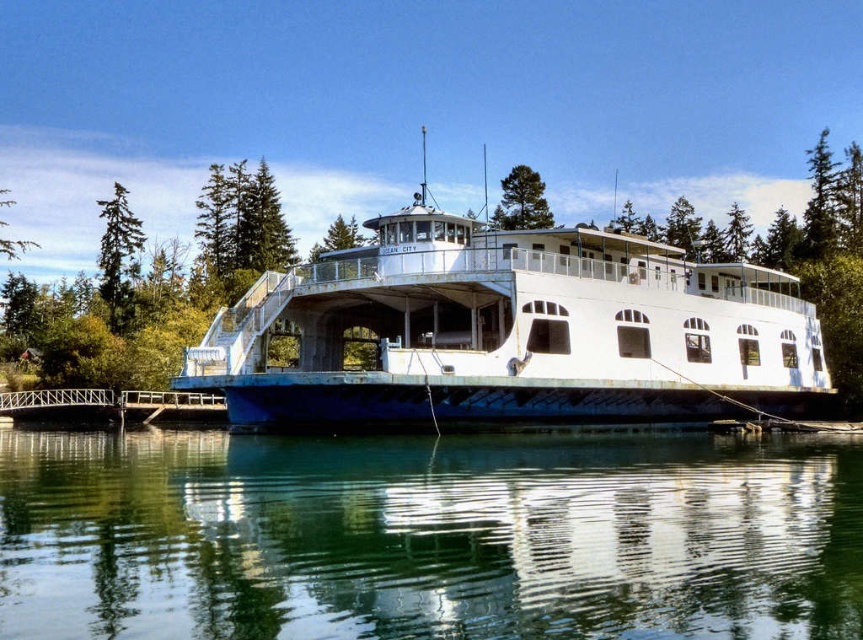
You are standing on the pier and want to board the ferry. The ferry is connected via a metal walkway. Where is the clear glass water at center in relation to your position?

The clear glass water at center is located at point coordinates (427, 536), which is near the center of the image, so it is positioned between the pier and the ferry where the metal walkway leads towards the ferry.

You are standing on the ferry and looking towards the pier. You notice two green trees in the distance. Which tree, the green textured tree at upper center or the green leafy tree at upper left, appears closer to you based on their sizes?

The green textured tree at upper center appears closer because it is shorter than the green leafy tree at upper left, which means the taller tree is farther away.

You are standing on the metallic gray dock at lower left and want to reach the green textured tree at upper center. The path between them is a straight walkway. If your walking speed is 3 feet per second, how many seconds will it take you to reach the tree?

The distance between the metallic gray dock at lower left and the green textured tree at upper center is 380.96 feet. At a walking speed of 3 feet per second, it would take approximately 126.99 seconds to reach the tree.